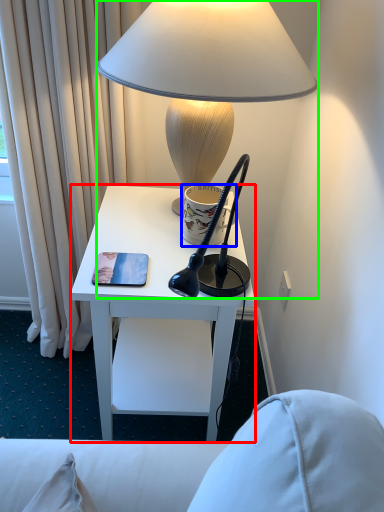
Question: Which is nearer to the desk (highlighted by a red box)? coffee cup (highlighted by a blue box) or lamp (highlighted by a green box).

Choices:
 (A) coffee cup
 (B) lamp

Answer: (A)